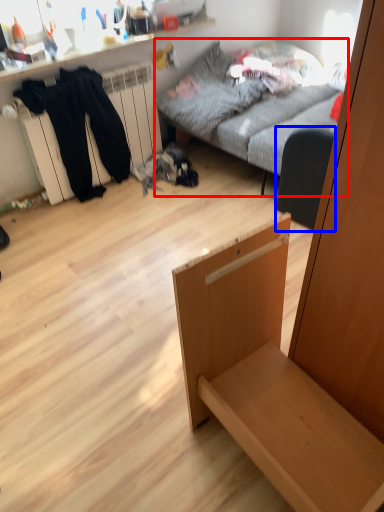
Question: Which point is further to the camera, studio couch (highlighted by a red box) or armchair (highlighted by a blue box)?

Choices:
 (A) studio couch
 (B) armchair

Answer: (B)